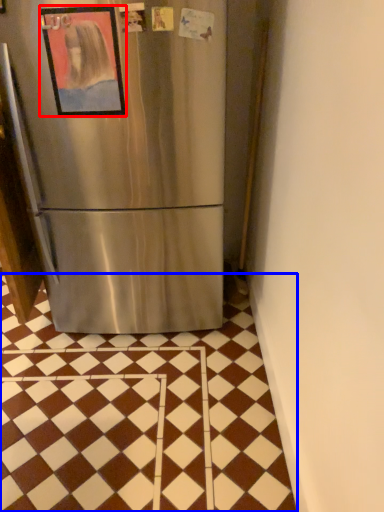
Question: Which object appears closest to the camera in this image, picture frame (highlighted by a red box) or tile (highlighted by a blue box)?

Choices:
 (A) picture frame
 (B) tile

Answer: (B)